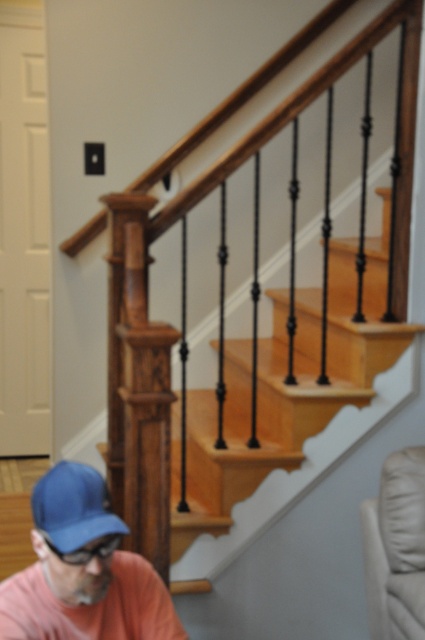
You are standing at the bottom of the staircase and want to move towards the light switch panel. There are two points marked on the wall near the top of the stairs. Which point, point (51, 474) or point (68, 497), is closer to the light switch panel?

Point (51, 474) is behind point (68, 497), so the closer point to the light switch panel would be point (68, 497).

You are standing at the bottom of the staircase and want to take a photo of the wooden stairs at upper center. According to the coordinates provided, where should you position your camera to capture the stairs at the center of the frame?

The wooden stairs at upper center are located at coordinates point (226, 396), so position your camera so that the center of the frame aligns with this point to capture them at the center of the photo.